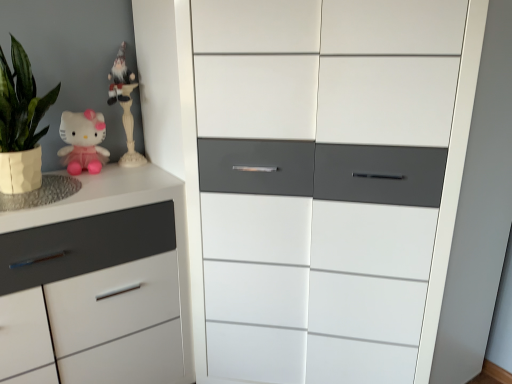
Question: Visually, is white matte chest of drawers at left, which ranks as the first chest of drawers in left-to-right order, positioned to the left or to the right of white glossy cabinet at center, the 1th chest of drawers viewed from the right?

Choices:
 (A) right
 (B) left

Answer: (B)

Question: In the image, is white matte chest of drawers at left, the second chest of drawers positioned from the right, positioned in front of or behind white glossy cabinet at center, the 1th chest of drawers viewed from the right?

Choices:
 (A) behind
 (B) front

Answer: (A)

Question: Based on their relative distances, which object is farther from the white glossy gnome at upper left?

Choices:
 (A) white matte chest of drawers at left, which ranks as the first chest of drawers in left-to-right order
 (B) matte pink plush at upper left
 (C) white glossy cabinet at center, the 1th chest of drawers viewed from the right

Answer: (C)

Question: Estimate the real-world distances between objects in this image. Which object is farther from the white glossy gnome at upper left?

Choices:
 (A) matte pink plush at upper left
 (B) white matte chest of drawers at left, the second chest of drawers positioned from the right
 (C) white glossy cabinet at center, positioned as the second chest of drawers in left-to-right order

Answer: (C)